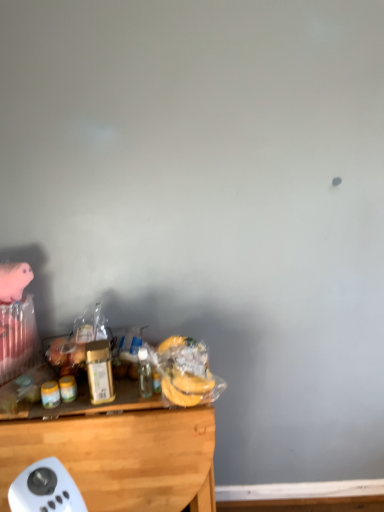
Question: Does yellow matte jar at left, the 2th food viewed from the right, have a lesser height compared to translucent plastic bottle at center, marked as the first bottle in a right-to-left arrangement?

Choices:
 (A) yes
 (B) no

Answer: (A)

Question: Considering the relative sizes of yellow matte jar at left, the 1th food in the left-to-right sequence, and translucent plastic bottle at center, marked as the first bottle in a right-to-left arrangement, in the image provided, is yellow matte jar at left, the 1th food in the left-to-right sequence, wider than translucent plastic bottle at center, marked as the first bottle in a right-to-left arrangement,?

Choices:
 (A) yes
 (B) no

Answer: (B)

Question: Is the depth of yellow matte jar at left, the 1th food in the left-to-right sequence, less than that of translucent plastic bottle at center, marked as the first bottle in a right-to-left arrangement?

Choices:
 (A) yes
 (B) no

Answer: (B)

Question: Is yellow matte jar at left, the 1th food in the left-to-right sequence, completely or partially outside of translucent plastic bottle at center, the 2th bottle in the left-to-right sequence?

Choices:
 (A) yes
 (B) no

Answer: (A)

Question: Can you confirm if yellow matte jar at left, the 2th food viewed from the right, is thinner than translucent plastic bottle at center, marked as the first bottle in a right-to-left arrangement?

Choices:
 (A) yes
 (B) no

Answer: (A)

Question: Based on their sizes in the image, would you say metallic gold canister at center, the first bottle positioned from the left, is bigger or smaller than wooden desk at lower left?

Choices:
 (A) small
 (B) big

Answer: (A)

Question: Considering the positions of point (92, 352) and point (87, 493), is point (92, 352) closer or farther from the camera than point (87, 493)?

Choices:
 (A) farther
 (B) closer

Answer: (B)

Question: From the image's perspective, is metallic gold canister at center, the first bottle positioned from the left, positioned above or below wooden desk at lower left?

Choices:
 (A) below
 (B) above

Answer: (B)

Question: Is metallic gold canister at center, the first bottle positioned from the left, to the left or to the right of wooden desk at lower left in the image?

Choices:
 (A) right
 (B) left

Answer: (A)

Question: From a real-world perspective, is translucent plastic bananas at lower center, acting as the first food starting from the right, above or below metallic gold canister at center, acting as the 2th bottle starting from the right?

Choices:
 (A) below
 (B) above

Answer: (A)

Question: Does point (205, 387) appear closer or farther from the camera than point (97, 359)?

Choices:
 (A) farther
 (B) closer

Answer: (A)

Question: Is translucent plastic bananas at lower center, acting as the first food starting from the right, situated inside metallic gold canister at center, acting as the 2th bottle starting from the right, or outside?

Choices:
 (A) inside
 (B) outside

Answer: (B)

Question: Based on their sizes in the image, would you say translucent plastic bananas at lower center, arranged as the second food when viewed from the left, is bigger or smaller than metallic gold canister at center, the first bottle positioned from the left?

Choices:
 (A) big
 (B) small

Answer: (A)

Question: Looking at their shapes, would you say yellow matte jar at left, the 2th food viewed from the right, is wider or thinner than metallic gold canister at center, acting as the 2th bottle starting from the right?

Choices:
 (A) wide
 (B) thin

Answer: (B)

Question: In the image, is yellow matte jar at left, the 1th food in the left-to-right sequence, on the left side or the right side of metallic gold canister at center, acting as the 2th bottle starting from the right?

Choices:
 (A) left
 (B) right

Answer: (A)